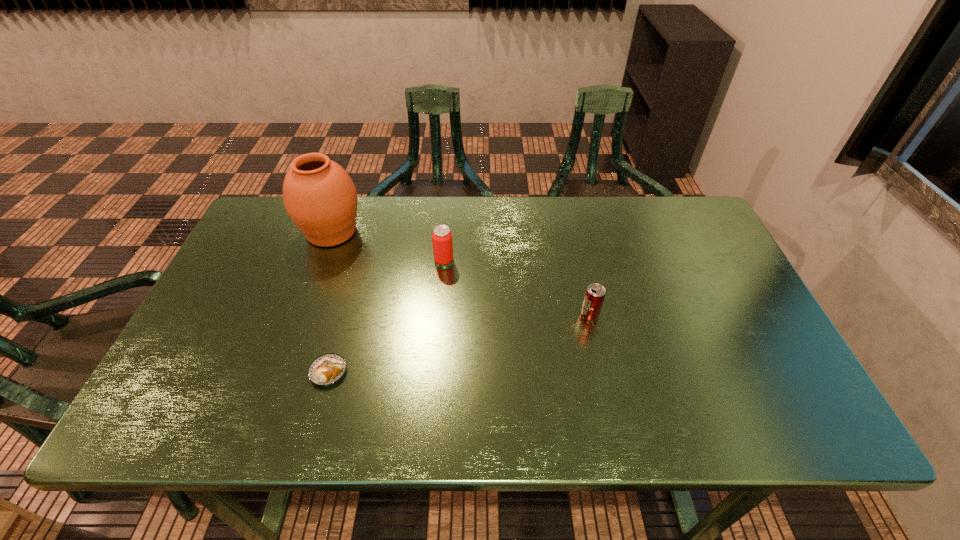
Locate an element on the screen. This screenshot has width=960, height=540. vacant area between the nearest object and the tallest object is located at coordinates (330, 302).

I want to click on free space between the nearest object and the third shortest object, so click(x=386, y=316).

Locate an element on the screen. unoccupied position between the urn and the shortest object is located at coordinates (330, 302).

Identify the location of vacant space that's between the nearest object and the nearer beer can. This screenshot has width=960, height=540. (459, 343).

You are a GUI agent. You are given a task and a screenshot of the screen. Output one action in this format:
    pyautogui.click(x=<x>, y=<y>)
    Task: Click on the vacant space in between the right beer can and the urn
    This screenshot has width=960, height=540.
    Given the screenshot: What is the action you would take?
    pyautogui.click(x=461, y=273)

You are a GUI agent. You are given a task and a screenshot of the screen. Output one action in this format:
    pyautogui.click(x=<x>, y=<y>)
    Task: Click on the free space between the right beer can and the second object from right to left
    This screenshot has width=960, height=540.
    Given the screenshot: What is the action you would take?
    tap(516, 287)

In order to click on blank region between the shortest object and the third shortest object in this screenshot , I will do `click(386, 316)`.

You are a GUI agent. You are given a task and a screenshot of the screen. Output one action in this format:
    pyautogui.click(x=<x>, y=<y>)
    Task: Click on the free space between the pastry and the second tallest object
    
    Given the screenshot: What is the action you would take?
    pyautogui.click(x=386, y=316)

The width and height of the screenshot is (960, 540). I want to click on free space between the pastry and the urn, so click(330, 302).

In order to click on object that is the third nearest to the taller beer can in this screenshot , I will do `click(594, 297)`.